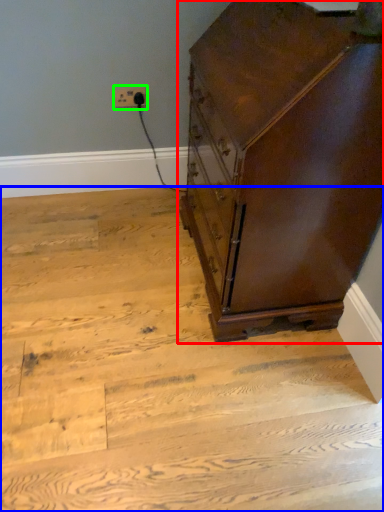
Question: Which object is the farthest from chest of drawers (highlighted by a red box)? Choose among these: stairwell (highlighted by a blue box) or electric outlet (highlighted by a green box).

Choices:
 (A) stairwell
 (B) electric outlet

Answer: (B)